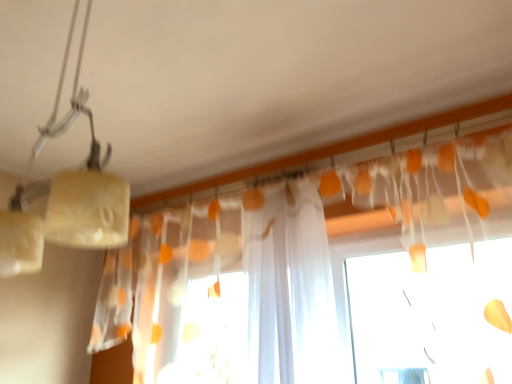
You are a GUI agent. You are given a task and a screenshot of the screen. Output one action in this format:
    pyautogui.click(x=<x>, y=<y>)
    Task: Click on the matte white lamp at upper left
    The image size is (512, 384).
    Given the screenshot: What is the action you would take?
    pyautogui.click(x=65, y=193)

Image resolution: width=512 pixels, height=384 pixels. Describe the element at coordinates (65, 193) in the screenshot. I see `matte white lamp at upper left` at that location.

This screenshot has width=512, height=384. What do you see at coordinates (297, 215) in the screenshot? I see `translucent white curtain at upper center` at bounding box center [297, 215].

Where is `translucent white curtain at upper center`? Image resolution: width=512 pixels, height=384 pixels. translucent white curtain at upper center is located at coordinates (297, 215).

Find the location of `matte white lamp at upper left`. matte white lamp at upper left is located at coordinates (65, 193).

Considering the relative positions of translucent white curtain at upper center and matte white lamp at upper left in the image provided, is translucent white curtain at upper center to the left of matte white lamp at upper left from the viewer's perspective?

No, translucent white curtain at upper center is not to the left of matte white lamp at upper left.

Between translucent white curtain at upper center and matte white lamp at upper left, which one is positioned in front?

Positioned in front is matte white lamp at upper left.

Is point (127, 346) positioned in front of point (38, 234)?

No.

From the image's perspective, is translucent white curtain at upper center under matte white lamp at upper left?

Yes.

From a real-world perspective, is translucent white curtain at upper center beneath matte white lamp at upper left?

Yes, from a real-world perspective, translucent white curtain at upper center is under matte white lamp at upper left.

Which object is thinner, translucent white curtain at upper center or matte white lamp at upper left?

translucent white curtain at upper center is thinner.

Can you confirm if translucent white curtain at upper center is shorter than matte white lamp at upper left?

No.

Does translucent white curtain at upper center have a larger size compared to matte white lamp at upper left?

Yes, translucent white curtain at upper center is bigger than matte white lamp at upper left.

Is translucent white curtain at upper center surrounding matte white lamp at upper left?

Definitely not — matte white lamp at upper left is not inside translucent white curtain at upper center.

Is translucent white curtain at upper center not near matte white lamp at upper left?

Yes.

Is translucent white curtain at upper center aimed at matte white lamp at upper left?

Yes, translucent white curtain at upper center is facing matte white lamp at upper left.

Consider the image. How many degrees apart are the facing directions of translucent white curtain at upper center and matte white lamp at upper left?

They differ by 89.4 degrees in their facing directions.

This screenshot has width=512, height=384. I want to click on lamp in front of the translucent white curtain at upper center, so click(x=65, y=193).

Based on their positions, is matte white lamp at upper left located to the left or right of translucent white curtain at upper center?

Based on their positions, matte white lamp at upper left is located to the left of translucent white curtain at upper center.

Is the position of matte white lamp at upper left more distant than that of translucent white curtain at upper center?

No, matte white lamp at upper left is closer to the viewer.

Which point is more forward, (25, 230) or (147, 277)?

The point (25, 230) is in front.

From the image's perspective, is matte white lamp at upper left above or below translucent white curtain at upper center?

matte white lamp at upper left is situated higher than translucent white curtain at upper center in the image.

From a real-world perspective, is matte white lamp at upper left above or below translucent white curtain at upper center?

matte white lamp at upper left is situated higher than translucent white curtain at upper center in the real world.

In terms of width, does matte white lamp at upper left look wider or thinner when compared to translucent white curtain at upper center?

Considering their sizes, matte white lamp at upper left looks broader than translucent white curtain at upper center.

In terms of height, does matte white lamp at upper left look taller or shorter compared to translucent white curtain at upper center?

Considering their sizes, matte white lamp at upper left has less height than translucent white curtain at upper center.

Is matte white lamp at upper left bigger than translucent white curtain at upper center?

Incorrect, matte white lamp at upper left is not larger than translucent white curtain at upper center.

Is matte white lamp at upper left not within translucent white curtain at upper center?

matte white lamp at upper left is positioned outside translucent white curtain at upper center.

Is matte white lamp at upper left far away from translucent white curtain at upper center?

Yes.

Is matte white lamp at upper left oriented towards translucent white curtain at upper center?

No, matte white lamp at upper left is not facing towards translucent white curtain at upper center.

Can you tell me how much matte white lamp at upper left and translucent white curtain at upper center differ in facing direction?

89.4 degrees separate the facing orientations of matte white lamp at upper left and translucent white curtain at upper center.

Measure the distance from matte white lamp at upper left to translucent white curtain at upper center.

The distance of matte white lamp at upper left from translucent white curtain at upper center is 1.04 meters.

You are a GUI agent. You are given a task and a screenshot of the screen. Output one action in this format:
    pyautogui.click(x=<x>, y=<y>)
    Task: Click on the curtain behind the matte white lamp at upper left
    The width and height of the screenshot is (512, 384).
    Given the screenshot: What is the action you would take?
    pyautogui.click(x=297, y=215)

This screenshot has width=512, height=384. In order to click on lamp on the left of translucent white curtain at upper center in this screenshot , I will do pyautogui.click(x=65, y=193).

The width and height of the screenshot is (512, 384). What are the coordinates of `curtain located on the right of matte white lamp at upper left` in the screenshot? It's located at tap(297, 215).